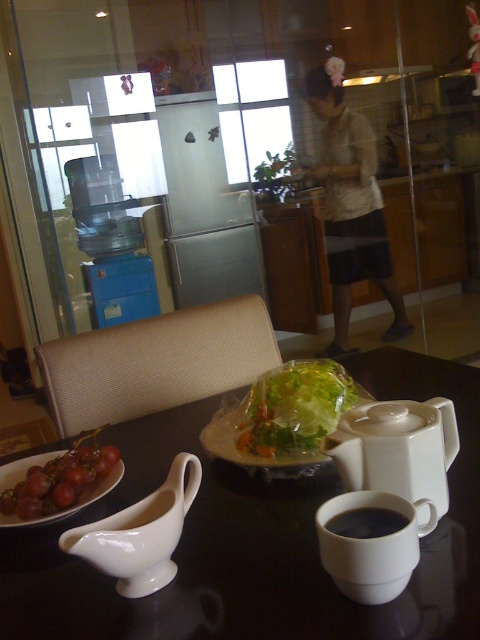
Does white glossy teapot at lower center have a greater height compared to matte white platter at lower left?

Correct, white glossy teapot at lower center is much taller as matte white platter at lower left.

Does white glossy teapot at lower center appear over matte white platter at lower left?

Yes, white glossy teapot at lower center is above matte white platter at lower left.

You are a GUI agent. You are given a task and a screenshot of the screen. Output one action in this format:
    pyautogui.click(x=<x>, y=<y>)
    Task: Click on the white glossy teapot at lower center
    
    Given the screenshot: What is the action you would take?
    pyautogui.click(x=140, y=532)

Find the location of a particular element. The image size is (480, 640). white glossy teapot at lower center is located at coordinates (140, 532).

Looking at this image, who is lower down, white matte teapot at center or translucent plastic salad at center?

white matte teapot at center is lower down.

Identify the location of white matte teapot at center. [396, 449].

Identify the location of white matte teapot at center. (396, 449).

You are a GUI agent. You are given a task and a screenshot of the screen. Output one action in this format:
    pyautogui.click(x=<x>, y=<y>)
    Task: Click on the white matte teapot at center
    The image size is (480, 640).
    Given the screenshot: What is the action you would take?
    pyautogui.click(x=396, y=449)

Can you confirm if white glossy table at center is thinner than white glossy teapot at lower center?

No, white glossy table at center is not thinner than white glossy teapot at lower center.

Does white glossy table at center lie in front of white glossy teapot at lower center?

Yes, it is in front of white glossy teapot at lower center.

Is point (10, 609) positioned behind point (168, 488)?

That is False.

This screenshot has height=640, width=480. What are the coordinates of `white glossy table at center` in the screenshot? It's located at (255, 540).